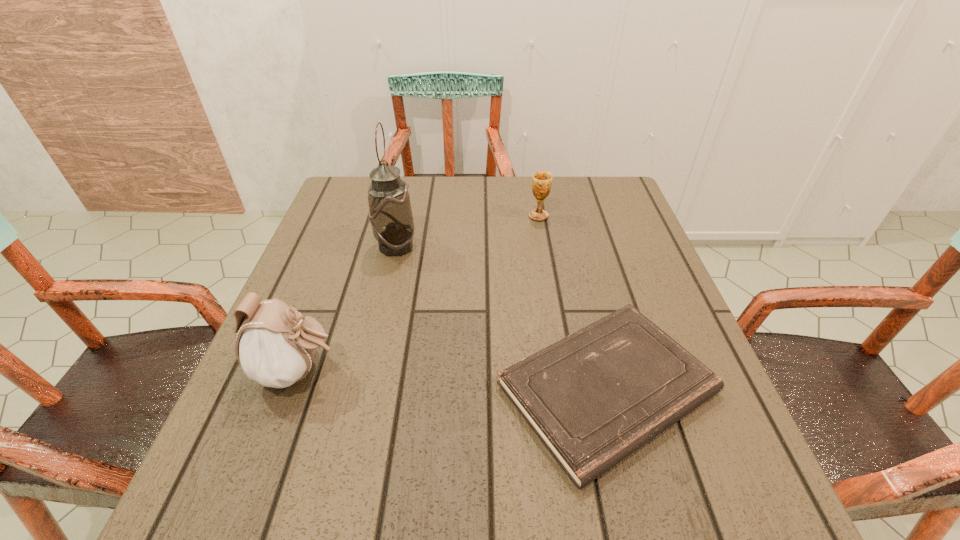
This screenshot has width=960, height=540. Identify the location of vacant space at the far right corner of the desktop. (580, 185).

Locate an element on the screen. Image resolution: width=960 pixels, height=540 pixels. vacant point located between the farthest object and the paperback book is located at coordinates (573, 302).

At what (x,y) coordinates should I click in order to perform the action: click on free space between the tallest object and the pouch. Please return your answer as a coordinate pair (x, y). The width and height of the screenshot is (960, 540). Looking at the image, I should click on (348, 309).

Identify the location of vacant point located between the oil lamp and the pouch. (348, 309).

Where is `empty space that is in between the paperback book and the second farthest object`? The width and height of the screenshot is (960, 540). empty space that is in between the paperback book and the second farthest object is located at coordinates (501, 318).

This screenshot has height=540, width=960. What are the coordinates of `vacant area that lies between the paperback book and the tallest object` in the screenshot? It's located at (501, 318).

Identify the location of empty space that is in between the second farthest object and the third tallest object. (468, 231).

Where is `free space between the third shortest object and the shortest object`? This screenshot has width=960, height=540. free space between the third shortest object and the shortest object is located at coordinates (453, 380).

Image resolution: width=960 pixels, height=540 pixels. I want to click on free space between the shortest object and the farthest object, so click(573, 302).

At what (x,y) coordinates should I click in order to perform the action: click on vacant region between the pouch and the oil lamp. Please return your answer as a coordinate pair (x, y). Image resolution: width=960 pixels, height=540 pixels. Looking at the image, I should click on (348, 309).